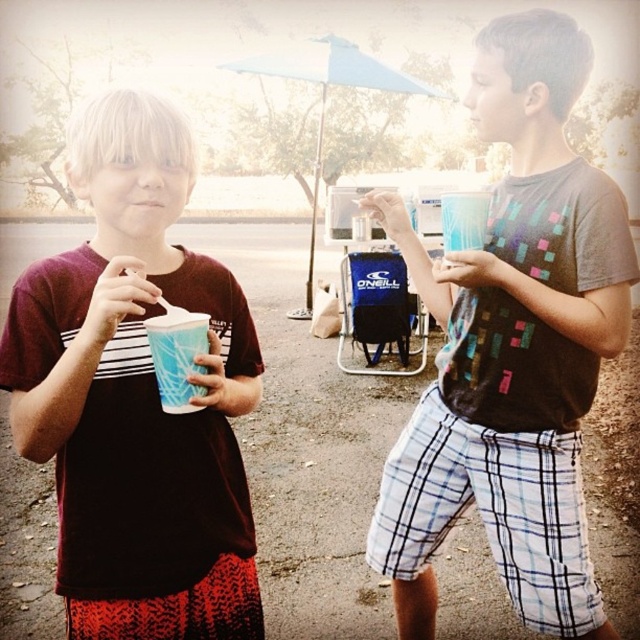
You are planning to use the blue fabric umbrella at center to cover the blue paper cup at left from the rain. Will the umbrella be wide enough to fully cover the cup?

The blue fabric umbrella at center has a lesser width compared to blue paper cup at left, so it will not be wide enough to fully cover the cup.

In the scene shown: You are a parent trying to decide which cup to use for your child. The matte plastic cup at center and the blue paper cup at left are available. If you want to choose the taller one, which should you pick?

The matte plastic cup at center is taller than the blue paper cup at left, so you should choose the matte plastic cup at center.